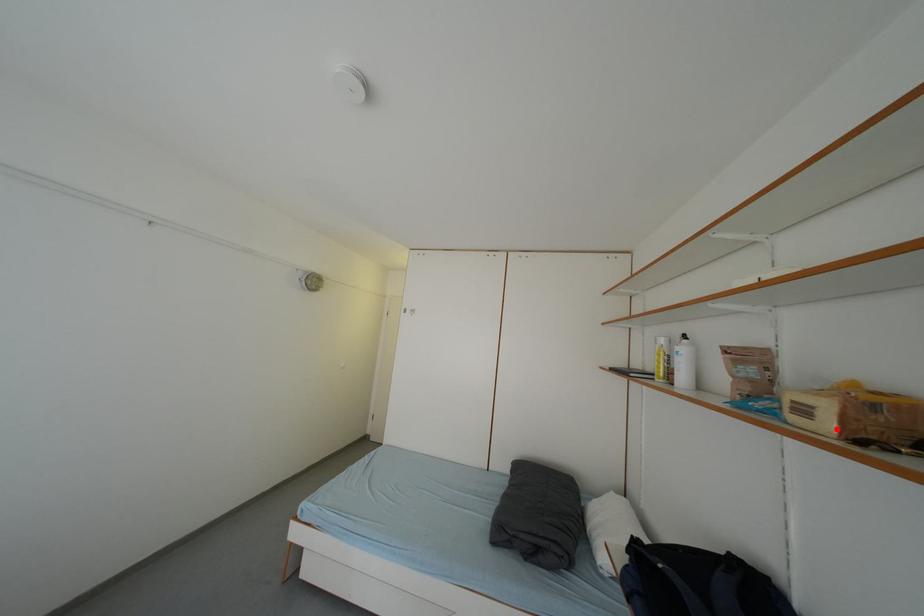
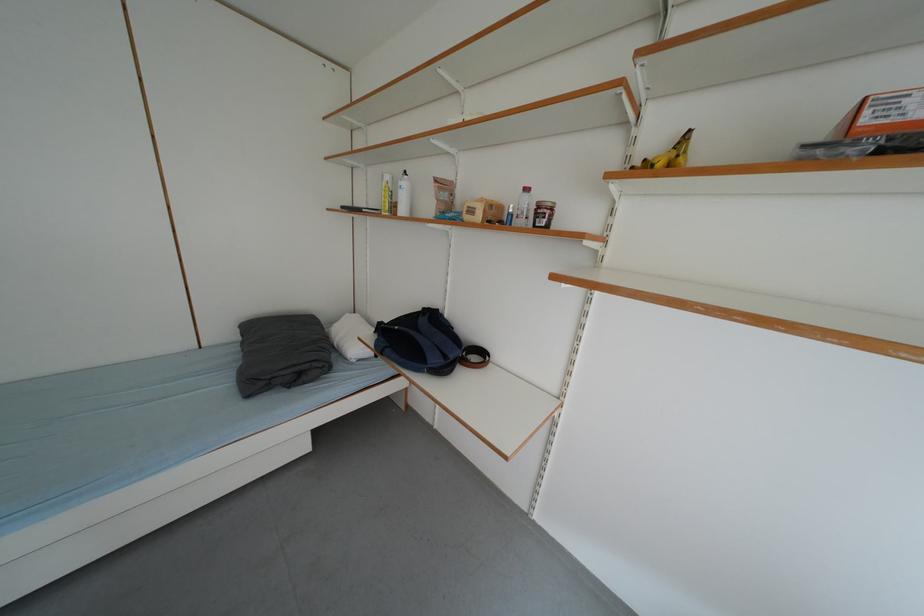
In the second image, find the point that corresponds to the highlighted location in the first image.

(487, 220)